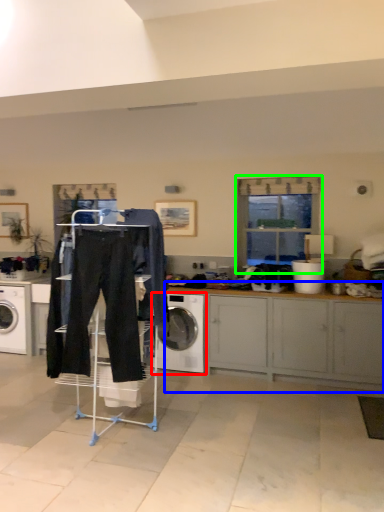
Question: Estimate the real-world distances between objects in this image. Which object is closer to washing machine (highlighted by a red box), cabinetry (highlighted by a blue box) or window (highlighted by a green box)?

Choices:
 (A) cabinetry
 (B) window

Answer: (A)